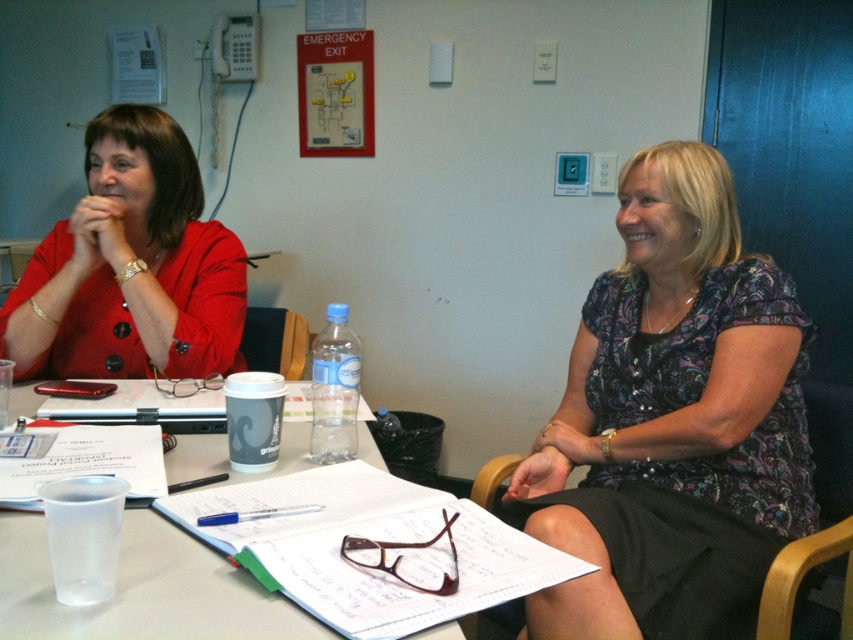
You are an interior designer analyzing the seating arrangement in the meeting room. The patterned fabric blouse at center is represented by point [674,420]. Based on the coordinates, is the blouse located closer to the left or right side of the table?

The patterned fabric blouse at center is represented by point [674,420]. Since the x coordinate is 0.658, which is closer to 1, the blouse is located closer to the right side of the table.

You are organizing a charity event and need to determine which clothing item to donate first based on size. Given the patterned fabric blouse at center and the matte red blazer at left, which one should you choose to donate first if you want to donate the larger item first?

The patterned fabric blouse at center is bigger than the matte red blazer at left, so you should donate the patterned fabric blouse at center first.

You are organizing a small event and need to place a decorative item on the table. The clear plastic cup at center is already there. Can you fit the patterned fabric blouse at center next to it without overlapping?

The patterned fabric blouse at center has a lesser width compared to the clear plastic cup at center, so it can be placed next to it without overlapping.